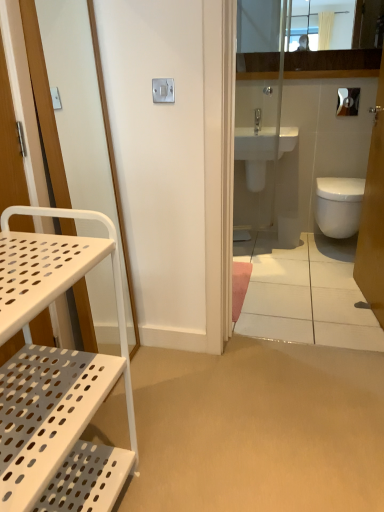
I want to click on free area in between white glossy screen door at upper right, marked as the first screen door in a right-to-left arrangement, and white glossy toilet at right, so click(316, 313).